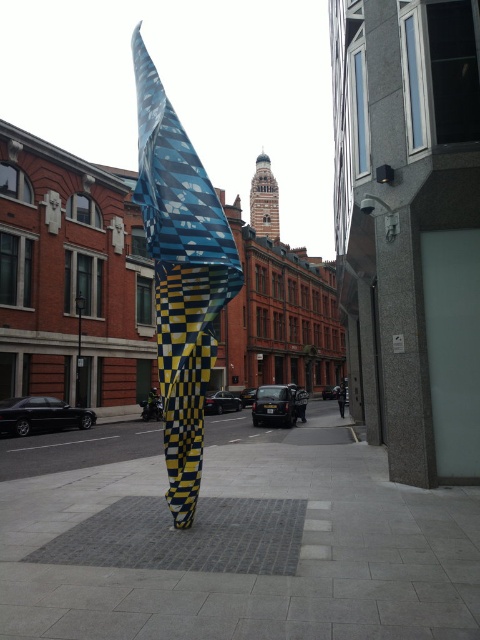
Question: Is the position of gray concrete pavement at center less distant than that of blue and yellow checkered fabric at center?

Choices:
 (A) no
 (B) yes

Answer: (B)

Question: Does gray concrete pavement at center appear on the right side of blue and yellow checkered fabric at center?

Choices:
 (A) no
 (B) yes

Answer: (B)

Question: Among these points, which one is farthest from the camera?

Choices:
 (A) (445, 595)
 (B) (184, 346)

Answer: (B)

Question: Observing the image, what is the correct spatial positioning of gray concrete pavement at center in reference to blue and yellow checkered fabric at center?

Choices:
 (A) above
 (B) below

Answer: (B)

Question: Which object is closer to the camera taking this photo?

Choices:
 (A) gray concrete pavement at center
 (B) blue and yellow checkered fabric at center

Answer: (A)

Question: Which point is farther to the camera?

Choices:
 (A) gray concrete pavement at center
 (B) blue and yellow checkered fabric at center

Answer: (B)